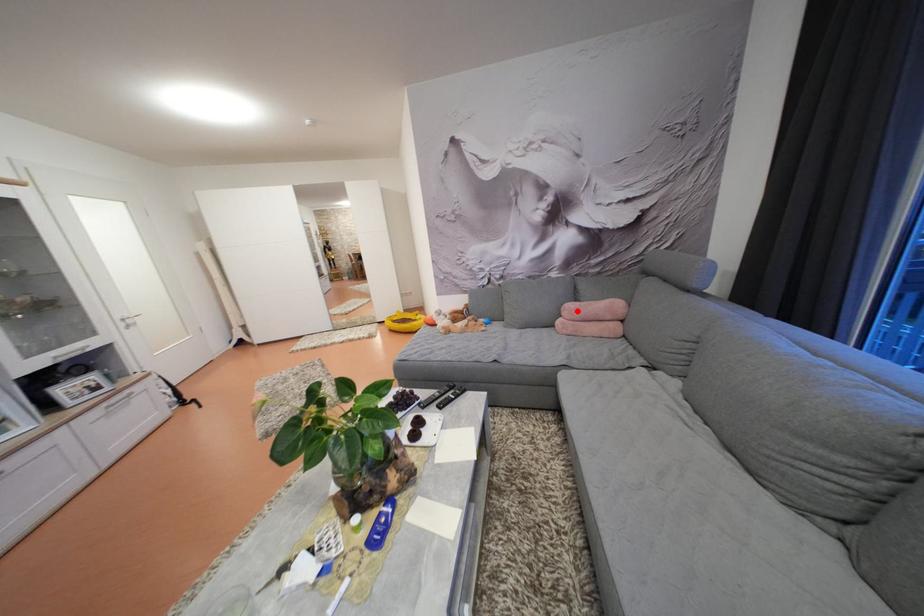
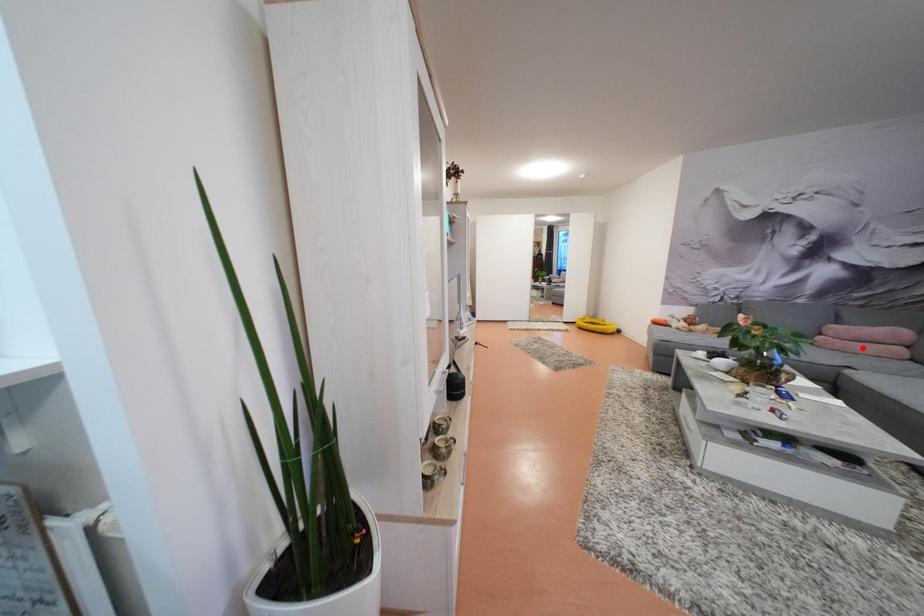
I am providing you with two images of the same scene from different viewpoints. A red point is marked on the first image and another point is marked on the second image. Are the points marked in image1 and image2 representing the same 3D position?

No